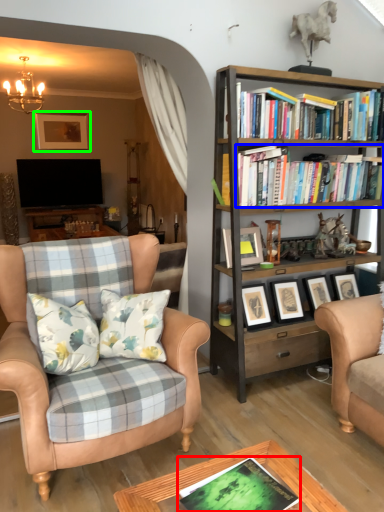
Question: Which object is the farthest from book (highlighted by a red box)? Choose among these: book (highlighted by a blue box) or picture frame (highlighted by a green box).

Choices:
 (A) book
 (B) picture frame

Answer: (B)